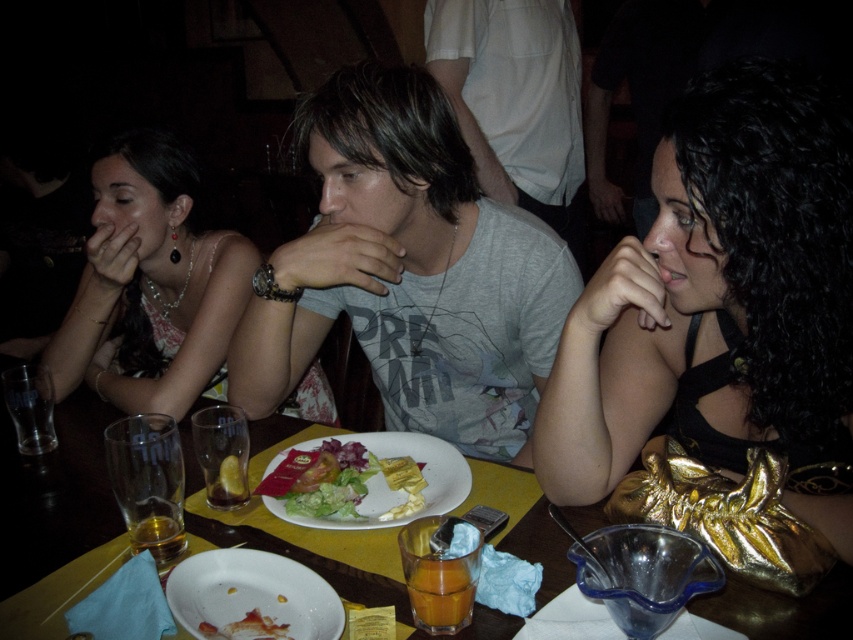
You are a waiter in a restaurant. You need to place a new order of drinks on the table. Where should you put them so they don not block the shiny gold purse at center right and the white matte plate at lower center?

The shiny gold purse at center right is in front of the white matte plate at lower center. To avoid blocking both items, place the drinks behind the white matte plate at lower center or to the side of the shiny gold purse at center right where there is space available.